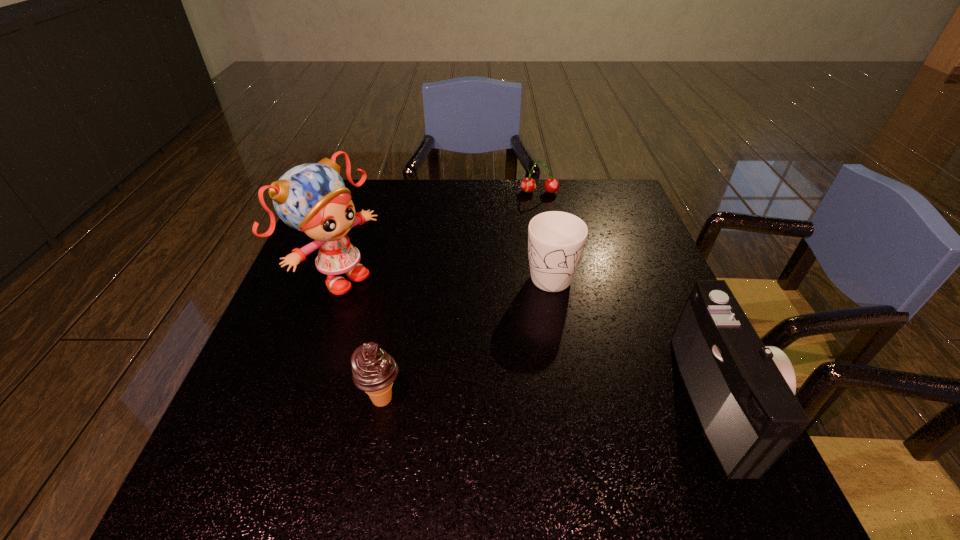
Where is `vacant region between the tallest object and the icecream`? The image size is (960, 540). vacant region between the tallest object and the icecream is located at coordinates (361, 339).

The height and width of the screenshot is (540, 960). In order to click on vacant point located between the camcorder and the farthest object in this screenshot , I will do `click(631, 296)`.

You are a GUI agent. You are given a task and a screenshot of the screen. Output one action in this format:
    pyautogui.click(x=<x>, y=<y>)
    Task: Click on the free area in between the icecream and the camcorder
    
    Given the screenshot: What is the action you would take?
    pyautogui.click(x=552, y=400)

This screenshot has height=540, width=960. I want to click on free space between the mug and the icecream, so click(466, 336).

Locate an element on the screen. free space that is in between the fourth object from right to left and the camcorder is located at coordinates (552, 400).

At what (x,y) coordinates should I click in order to perform the action: click on free space between the camcorder and the farthest object. Please return your answer as a coordinate pair (x, y). Looking at the image, I should click on (631, 296).

Find the location of `vacant region between the camcorder and the leftmost object`. vacant region between the camcorder and the leftmost object is located at coordinates (531, 339).

The image size is (960, 540). In order to click on free spot between the cherry and the tallest object in this screenshot , I will do `click(439, 235)`.

Find the location of a particular element. object identified as the second closest to the camcorder is located at coordinates (373, 370).

Select which object appears as the second closest to the tallest object. Please provide its 2D coordinates. Your answer should be formatted as a tuple, i.e. [(x, y)], where the tuple contains the x and y coordinates of a point satisfying the conditions above.

[(556, 240)]